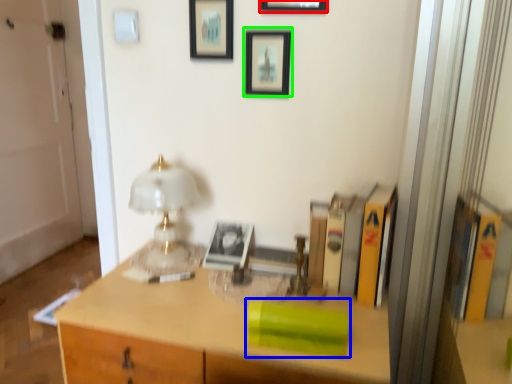
Question: Considering the real-world distances, which object is closest to picture frame (highlighted by a red box)? book (highlighted by a blue box) or picture frame (highlighted by a green box).

Choices:
 (A) book
 (B) picture frame

Answer: (B)